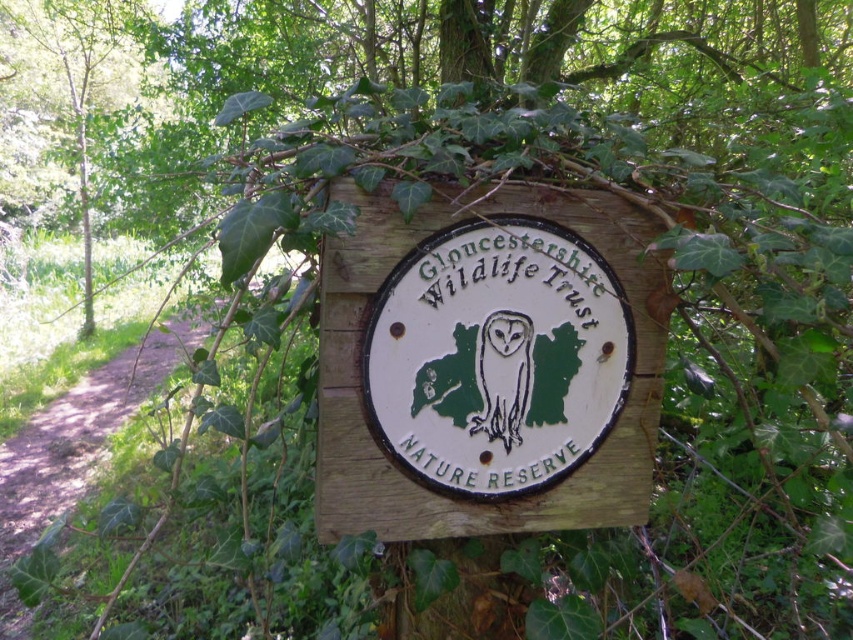
You are standing in front of a wooden signboard in a nature reserve. You notice two points marked on the signboard at coordinates point (375, 289) and point (13, 486). Which point is closer to you as you face the signboard?

Point (375, 289) is closer to the camera than point (13, 486), so the point closer to you as you face the signboard is point (375, 289).